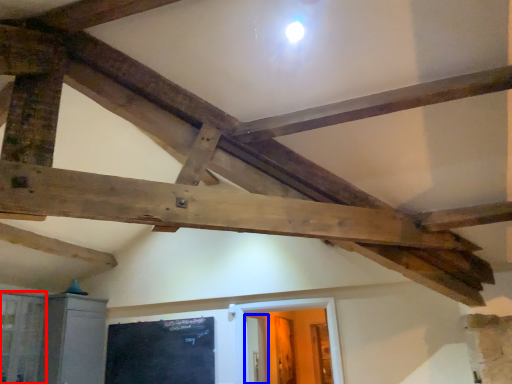
Question: Which object is closer to the camera taking this photo, window (highlighted by a red box) or door (highlighted by a blue box)?

Choices:
 (A) window
 (B) door

Answer: (A)